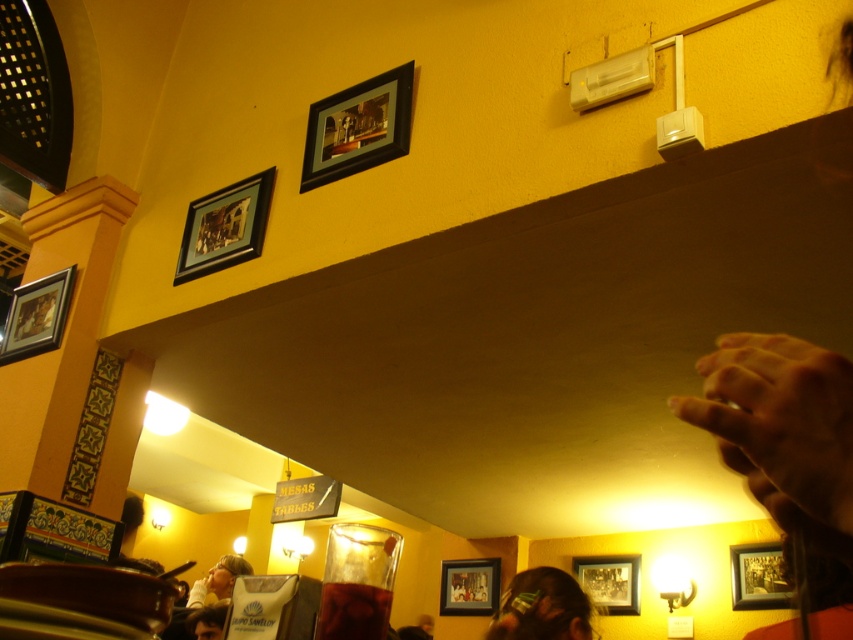
Can you confirm if black matte picture frame at upper center is taller than wooden frame at lower right?

Yes.

Can you confirm if black matte picture frame at upper center is positioned above wooden frame at lower right?

Indeed, black matte picture frame at upper center is positioned over wooden frame at lower right.

Is point (325, 134) farther from camera compared to point (769, 564)?

No, it is in front of (769, 564).

Identify the location of black matte picture frame at upper center. (358, 128).

Can you confirm if smooth skin hand at right is positioned below matte black picture frame at upper left?

Yes, smooth skin hand at right is below matte black picture frame at upper left.

Describe the element at coordinates (782, 417) in the screenshot. I see `smooth skin hand at right` at that location.

Does point (740, 362) come in front of point (260, 228)?

Yes, it is in front of point (260, 228).

Identify the location of smooth skin hand at right. This screenshot has height=640, width=853. (782, 417).

Between point (531, 609) and point (630, 595), which one is positioned behind?

Positioned behind is point (630, 595).

Can you confirm if dark brown hair at lower center is positioned above wooden picture frame at lower right?

Indeed, dark brown hair at lower center is positioned over wooden picture frame at lower right.

Does point (534, 596) lie in front of point (618, 589)?

Yes.

You are a GUI agent. You are given a task and a screenshot of the screen. Output one action in this format:
    pyautogui.click(x=<x>, y=<y>)
    Task: Click on the dark brown hair at lower center
    This screenshot has width=853, height=640.
    Given the screenshot: What is the action you would take?
    pyautogui.click(x=543, y=608)